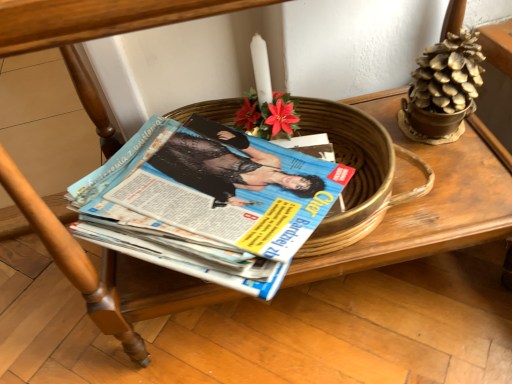
Question: Considering the relative sizes of blue glossy magazine at center and gold metallic pinecone at upper right in the image provided, is blue glossy magazine at center wider than gold metallic pinecone at upper right?

Choices:
 (A) no
 (B) yes

Answer: (B)

Question: From a real-world perspective, is blue glossy magazine at center physically below gold metallic pinecone at upper right?

Choices:
 (A) yes
 (B) no

Answer: (A)

Question: From a real-world perspective, does blue glossy magazine at center stand above gold metallic pinecone at upper right?

Choices:
 (A) yes
 (B) no

Answer: (B)

Question: Would you say blue glossy magazine at center is outside gold metallic pinecone at upper right?

Choices:
 (A) no
 (B) yes

Answer: (B)

Question: Does blue glossy magazine at center have a larger size compared to gold metallic pinecone at upper right?

Choices:
 (A) no
 (B) yes

Answer: (B)

Question: Is blue glossy magazine at center aimed at gold metallic pinecone at upper right?

Choices:
 (A) no
 (B) yes

Answer: (A)

Question: Is gold metallic pinecone at upper right turned away from blue glossy magazine at center?

Choices:
 (A) no
 (B) yes

Answer: (A)

Question: From the image's perspective, is gold metallic pinecone at upper right on blue glossy magazine at center?

Choices:
 (A) yes
 (B) no

Answer: (A)

Question: Considering the relative sizes of gold metallic pinecone at upper right and blue glossy magazine at center in the image provided, is gold metallic pinecone at upper right wider than blue glossy magazine at center?

Choices:
 (A) yes
 (B) no

Answer: (B)

Question: Is gold metallic pinecone at upper right far from blue glossy magazine at center?

Choices:
 (A) yes
 (B) no

Answer: (B)

Question: Is gold metallic pinecone at upper right smaller than blue glossy magazine at center?

Choices:
 (A) no
 (B) yes

Answer: (B)

Question: Can you confirm if gold metallic pinecone at upper right is bigger than blue glossy magazine at center?

Choices:
 (A) yes
 (B) no

Answer: (B)

Question: Does gold metallic pinecone at upper right have a greater width compared to gold metallic flowerpot at upper right?

Choices:
 (A) yes
 (B) no

Answer: (A)